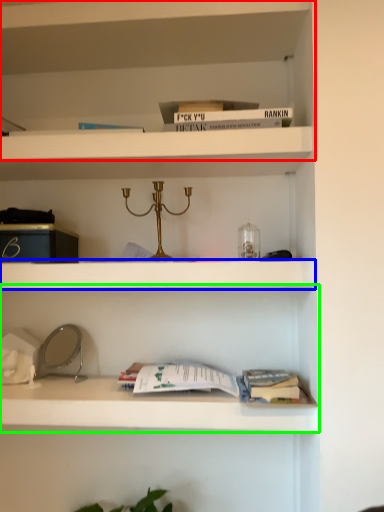
Question: Considering the real-world distances, which object is closest to shelf (highlighted by a red box)? cabinet (highlighted by a blue box) or shelf (highlighted by a green box).

Choices:
 (A) cabinet
 (B) shelf

Answer: (A)